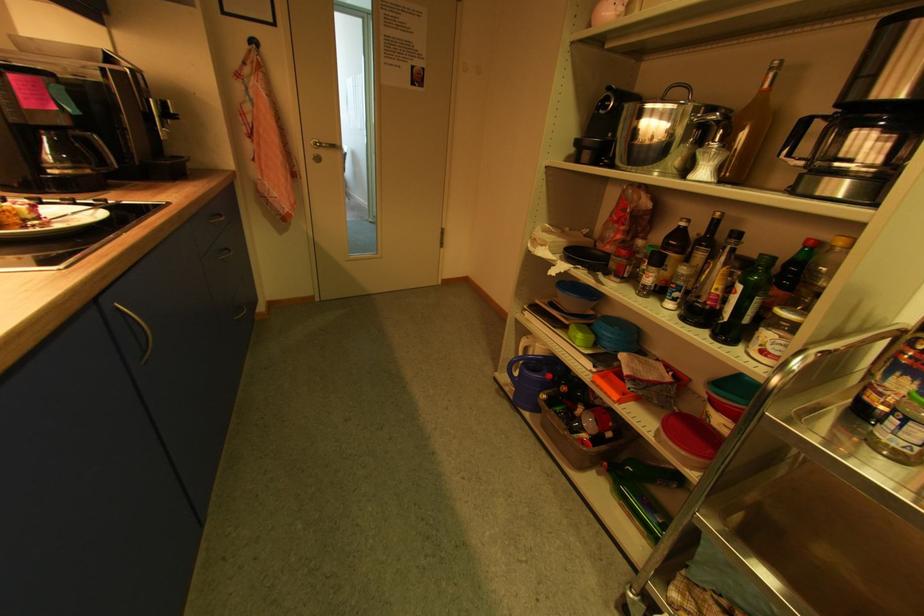
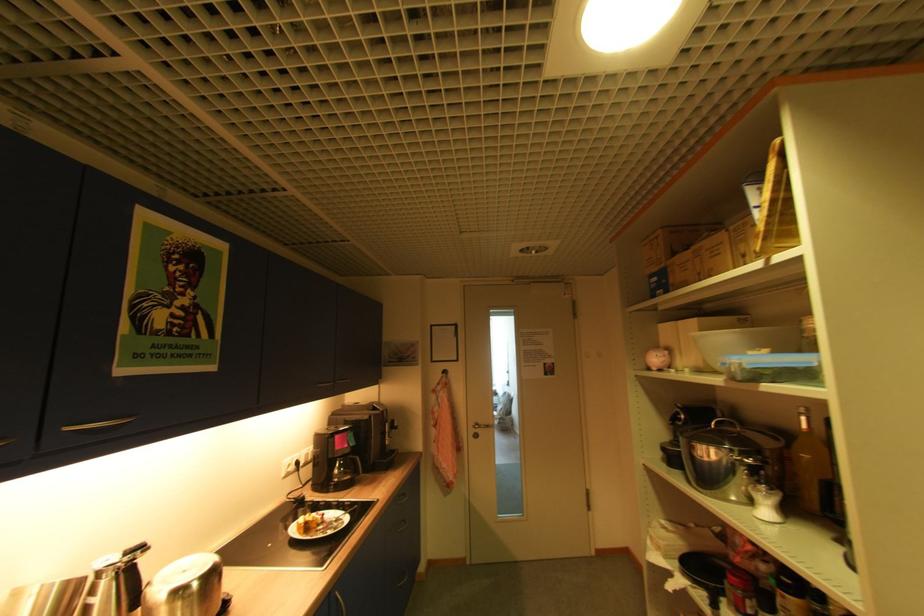
Find the pixel in the second image that matches pixel 709 175 in the first image.

(772, 513)